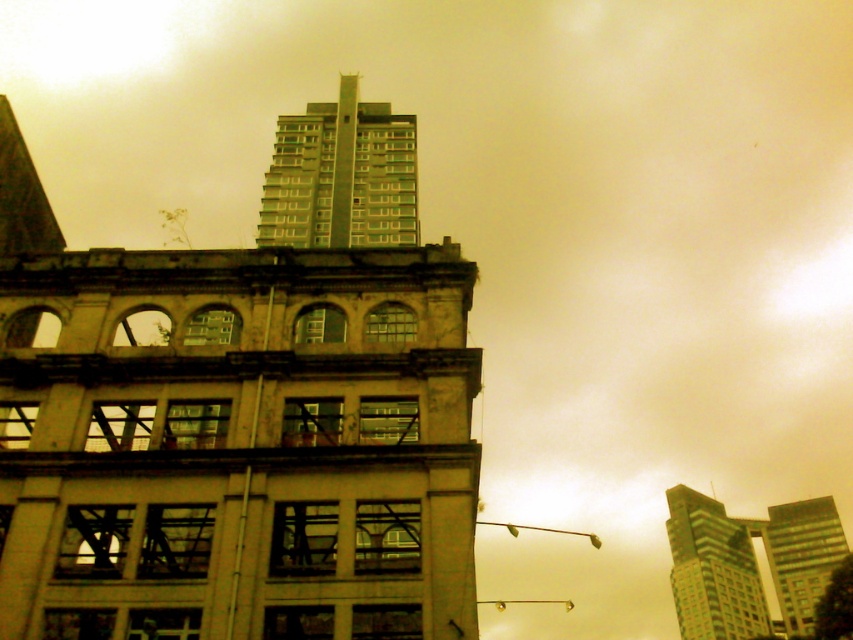
Question: Can you confirm if green glass building at upper right is thinner than green glass skyscraper at upper right?

Choices:
 (A) no
 (B) yes

Answer: (B)

Question: Is green glass building at upper right positioned before green glass skyscraper at upper right?

Choices:
 (A) yes
 (B) no

Answer: (B)

Question: Which of the following is the closest to the observer?

Choices:
 (A) green glass building at upper right
 (B) green glass building at upper center
 (C) green glass skyscraper at upper right

Answer: (B)

Question: Which point appears closest to the camera in this image?

Choices:
 (A) [375, 182]
 (B) [721, 554]
 (C) [815, 509]

Answer: (A)

Question: Where is green glass building at upper center located in relation to green glass building at upper right in the image?

Choices:
 (A) right
 (B) left

Answer: (B)

Question: Based on their relative distances, which object is farther from the green glass building at upper right?

Choices:
 (A) green glass building at upper center
 (B) green glass skyscraper at upper right

Answer: (A)